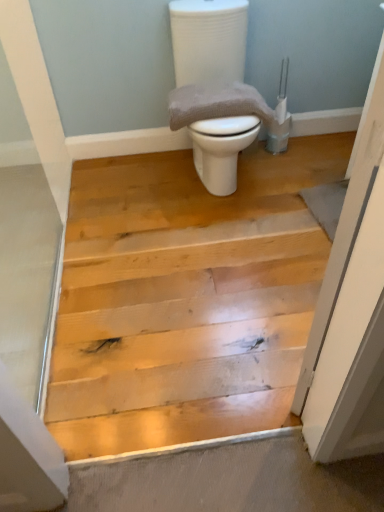
What is the approximate width of gray textured towel at center?

It is 13.09 inches.

Where is `gray textured towel at center`? gray textured towel at center is located at coordinates (216, 103).

Image resolution: width=384 pixels, height=512 pixels. Describe the element at coordinates (216, 103) in the screenshot. I see `gray textured towel at center` at that location.

This screenshot has width=384, height=512. Describe the element at coordinates (214, 87) in the screenshot. I see `white glossy toilet at center` at that location.

Where is `white glossy toilet at center`? This screenshot has height=512, width=384. white glossy toilet at center is located at coordinates (214, 87).

You are a GUI agent. You are given a task and a screenshot of the screen. Output one action in this format:
    pyautogui.click(x=<x>, y=<y>)
    Task: Click on the gray textured towel at center
    The height and width of the screenshot is (512, 384).
    Given the screenshot: What is the action you would take?
    pyautogui.click(x=216, y=103)

Which is more to the left, white glossy toilet at center or gray textured towel at center?

Positioned to the left is gray textured towel at center.

Which object is further away from the camera taking this photo, white glossy toilet at center or gray textured towel at center?

gray textured towel at center is further from the camera.

Between point (216, 67) and point (225, 111), which one is positioned in front?

The point (225, 111) is closer to the camera.

From the image's perspective, is white glossy toilet at center on gray textured towel at center?

Yes, from the image's perspective, white glossy toilet at center is over gray textured towel at center.

From a real-world perspective, relative to gray textured towel at center, is white glossy toilet at center vertically above or below?

In terms of real-world spatial position, white glossy toilet at center is below gray textured towel at center.

Considering the relative sizes of white glossy toilet at center and gray textured towel at center in the image provided, is white glossy toilet at center wider than gray textured towel at center?

Indeed, white glossy toilet at center has a greater width compared to gray textured towel at center.

From the picture: Considering the sizes of objects white glossy toilet at center and gray textured towel at center in the image provided, who is taller, white glossy toilet at center or gray textured towel at center?

With more height is white glossy toilet at center.

Who is bigger, white glossy toilet at center or gray textured towel at center?

Bigger between the two is white glossy toilet at center.

Can gray textured towel at center be found inside white glossy toilet at center?

Yes, gray textured towel at center is a part of white glossy toilet at center.

Can you see white glossy toilet at center touching gray textured towel at center?

white glossy toilet at center and gray textured towel at center are not in contact.

Is white glossy toilet at center turned away from gray textured towel at center?

Yes, white glossy toilet at center is facing away from gray textured towel at center.

What's the angular difference between white glossy toilet at center and gray textured towel at center's facing directions?

0.000221 degrees separate the facing orientations of white glossy toilet at center and gray textured towel at center.

Measure the distance from white glossy toilet at center to gray textured towel at center.

white glossy toilet at center and gray textured towel at center are 4.35 inches apart.

Locate an element on the screen. Image resolution: width=384 pixels, height=512 pixels. toilet in front of the gray textured towel at center is located at coordinates (214, 87).

Is gray textured towel at center to the left of white glossy toilet at center from the viewer's perspective?

Indeed, gray textured towel at center is positioned on the left side of white glossy toilet at center.

Is gray textured towel at center in front of or behind white glossy toilet at center in the image?

Visually, gray textured towel at center is located behind white glossy toilet at center.

Which point is more distant from viewer, (x=189, y=98) or (x=209, y=97)?

Positioned behind is point (x=189, y=98).

From the image's perspective, between gray textured towel at center and white glossy toilet at center, which one is located above?

white glossy toilet at center appears higher in the image.

From a real-world perspective, does gray textured towel at center sit lower than white glossy toilet at center?

Actually, gray textured towel at center is physically above white glossy toilet at center in the real world.

Can you confirm if gray textured towel at center is wider than white glossy toilet at center?

No, gray textured towel at center is not wider than white glossy toilet at center.

Between gray textured towel at center and white glossy toilet at center, which one has less height?

gray textured towel at center is shorter.

Considering the sizes of objects gray textured towel at center and white glossy toilet at center in the image provided, who is smaller, gray textured towel at center or white glossy toilet at center?

gray textured towel at center.

Is gray textured towel at center inside or outside of white glossy toilet at center?

gray textured towel at center is enclosed within white glossy toilet at center.

Are gray textured towel at center and white glossy toilet at center far apart?

No, there isn't a large distance between gray textured towel at center and white glossy toilet at center.

Is gray textured towel at center aimed at white glossy toilet at center?

Yes, gray textured towel at center is facing white glossy toilet at center.

Measure the distance between gray textured towel at center and white glossy toilet at center.

They are 11.05 centimeters apart.

Locate an element on the screen. Image resolution: width=384 pixels, height=512 pixels. material that appears behind the white glossy toilet at center is located at coordinates (216, 103).

The image size is (384, 512). Find the location of `material located behind the white glossy toilet at center`. material located behind the white glossy toilet at center is located at coordinates (216, 103).

The height and width of the screenshot is (512, 384). In order to click on toilet on the right of gray textured towel at center in this screenshot , I will do `click(214, 87)`.